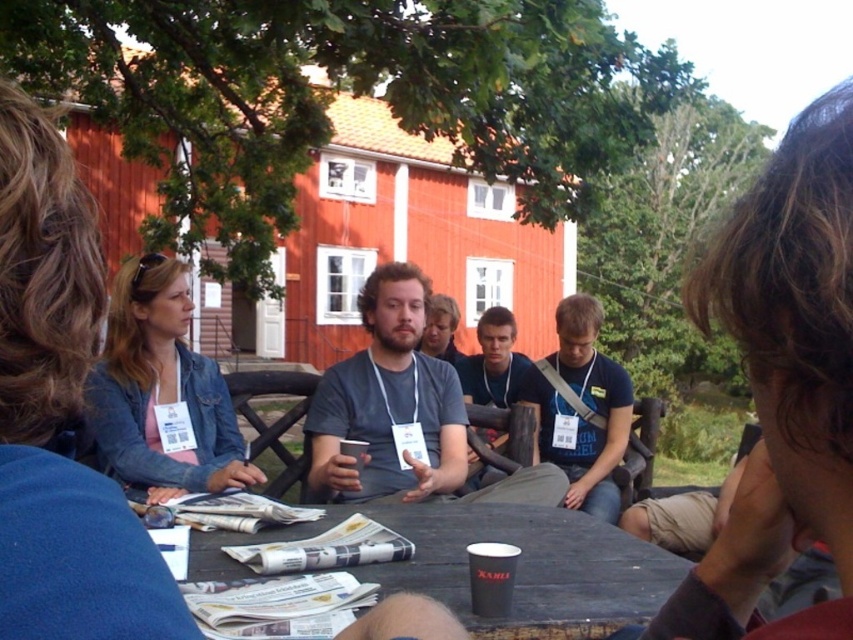
Who is more forward, (305,422) or (492,323)?

Point (305,422) is more forward.

You are a GUI agent. You are given a task and a screenshot of the screen. Output one action in this format:
    pyautogui.click(x=<x>, y=<y>)
    Task: Click on the matte gray t-shirt at center
    Image resolution: width=853 pixels, height=640 pixels.
    Given the screenshot: What is the action you would take?
    pyautogui.click(x=389, y=401)

The height and width of the screenshot is (640, 853). I want to click on matte gray t-shirt at center, so click(x=389, y=401).

Locate an element on the screen. matte gray t-shirt at center is located at coordinates (389, 401).

Between wooden picnic table at center and matte gray shirt at center, which one is positioned lower?

Positioned lower is wooden picnic table at center.

Between wooden picnic table at center and matte gray shirt at center, which one appears on the right side from the viewer's perspective?

matte gray shirt at center is more to the right.

Who is more forward, (543, 584) or (489, 394)?

Point (543, 584) is more forward.

The image size is (853, 640). I want to click on wooden picnic table at center, so click(517, 570).

Who is lower down, matte gray t-shirt at center or blue fabric shirt at center?

blue fabric shirt at center

Can you confirm if matte gray t-shirt at center is bigger than blue fabric shirt at center?

No.

Locate an element on the screen. The height and width of the screenshot is (640, 853). matte gray t-shirt at center is located at coordinates (389, 401).